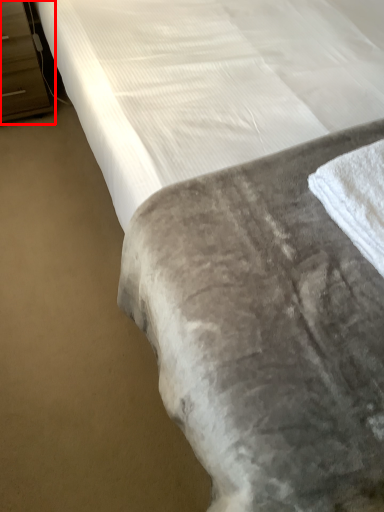
Question: In this image, where is dresser (annotated by the red box) located relative to bath towel?

Choices:
 (A) right
 (B) left

Answer: (B)